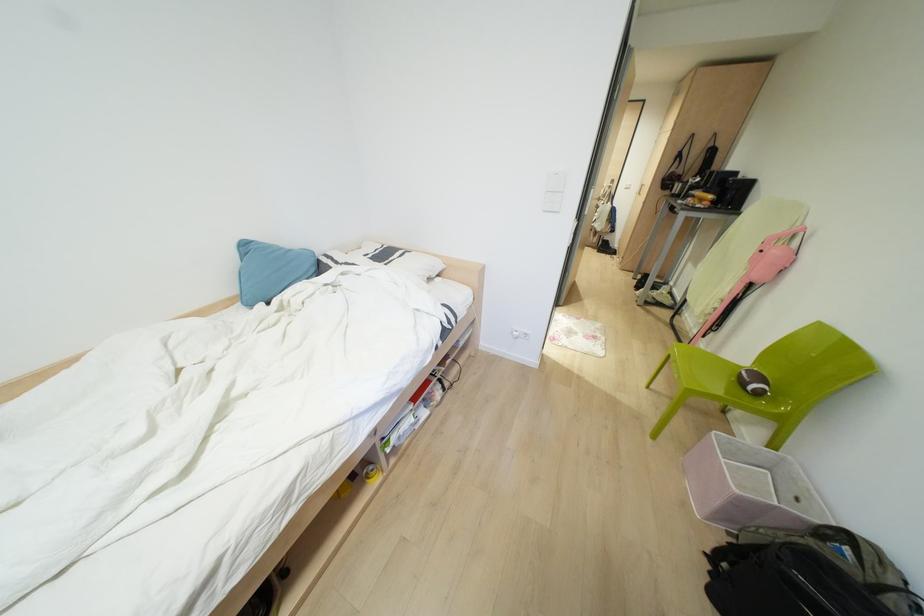
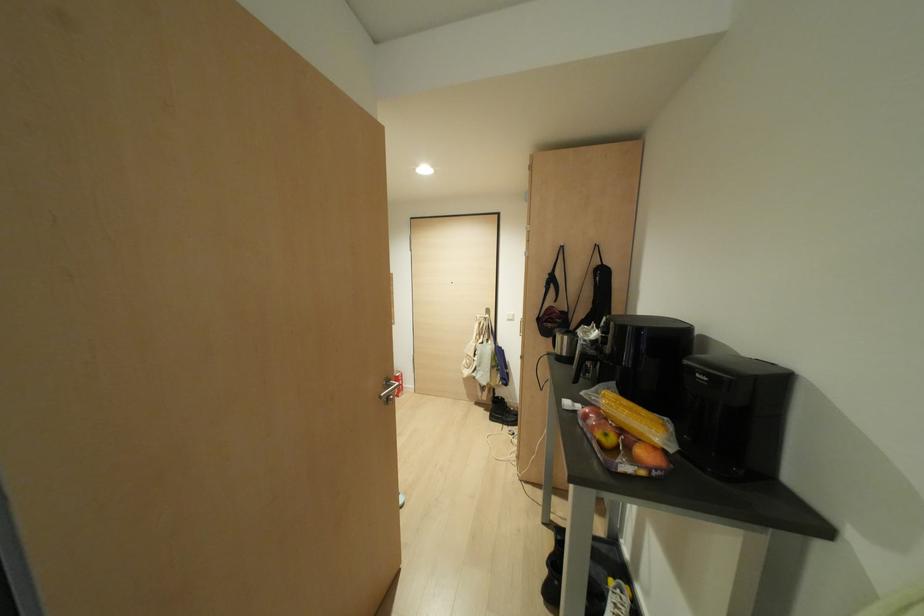
Find the pixel in the second image that matches [613,209] in the first image.

(497, 352)